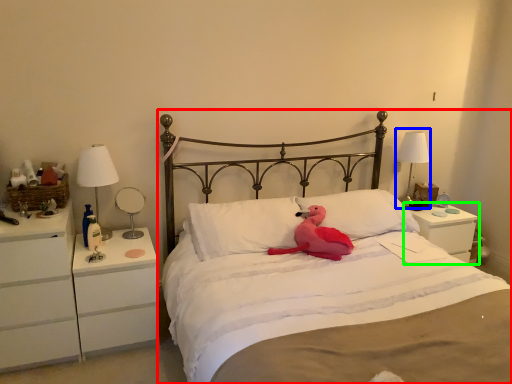
Question: Which object is positioned farthest from bed (highlighted by a red box)? Select from bedside lamp (highlighted by a blue box) and nightstand (highlighted by a green box).

Choices:
 (A) bedside lamp
 (B) nightstand

Answer: (A)